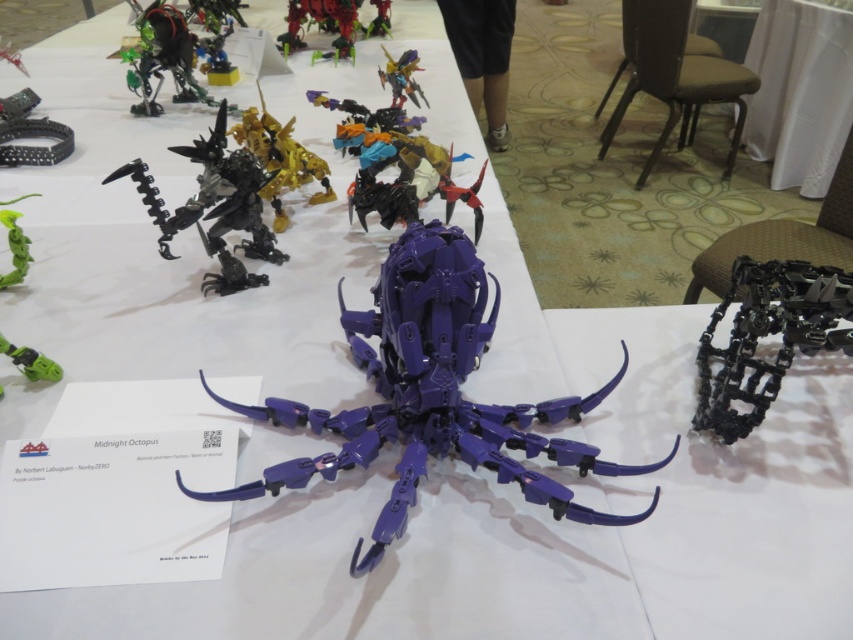
You are a roboticist examining the table layout. The point at coordinates (432, 394) is marked on your map. Which robotic model does this point correspond to?

The point at coordinates (432, 394) marks the purple plastic octopus at center.

You are an art curator planning to move the purple plastic octopus at center and the metallic green robot at upper center to a new exhibition space. Based on their positions in the current setup, which object is located higher up?

The metallic green robot at upper center is located higher up than the purple plastic octopus at center.

You are an exhibit assistant who needs to arrange these items for a display. Considering the green matte plant at upper left and the green matte claw at lower left, which one should you place in a more prominent position to ensure visibility?

The green matte plant at upper left should be placed in a more prominent position because it is larger than the green matte claw at lower left, making it easier to see from a distance.